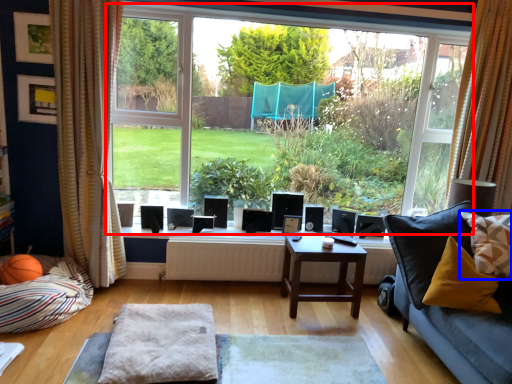
Question: Which of the following is the farthest to the observer, window (highlighted by a red box) or pillow (highlighted by a blue box)?

Choices:
 (A) window
 (B) pillow

Answer: (A)